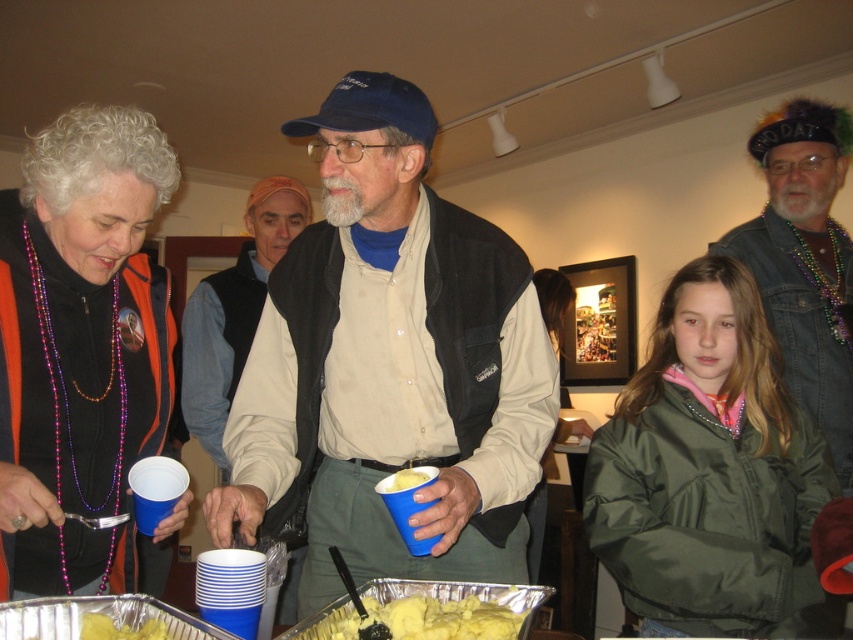
Question: Can you confirm if denim jacket at upper right is positioned to the right of beige fabric vest at center?

Choices:
 (A) yes
 (B) no

Answer: (A)

Question: Considering the real-world distances, which object is farthest from the matte black vest at center?

Choices:
 (A) denim jacket at upper right
 (B) orange fabric vest at left
 (C) yellow matte cupcake at center

Answer: (A)

Question: Considering the relative positions of matte black vest at center and green puffy jacket at center in the image provided, where is matte black vest at center located with respect to green puffy jacket at center?

Choices:
 (A) left
 (B) right

Answer: (A)

Question: Which of the following is the farthest from the observer?

Choices:
 (A) (77, 508)
 (B) (106, 636)
 (C) (404, 141)
 (D) (814, 372)

Answer: (D)

Question: Considering the relative positions of green puffy jacket at center and beige fabric vest at center in the image provided, where is green puffy jacket at center located with respect to beige fabric vest at center?

Choices:
 (A) right
 (B) left

Answer: (A)

Question: Which of these objects is positioned closest to the yellow mashed potatoes at center?

Choices:
 (A) denim jacket at upper right
 (B) green puffy jacket at center
 (C) yellow matte cupcake at center

Answer: (C)